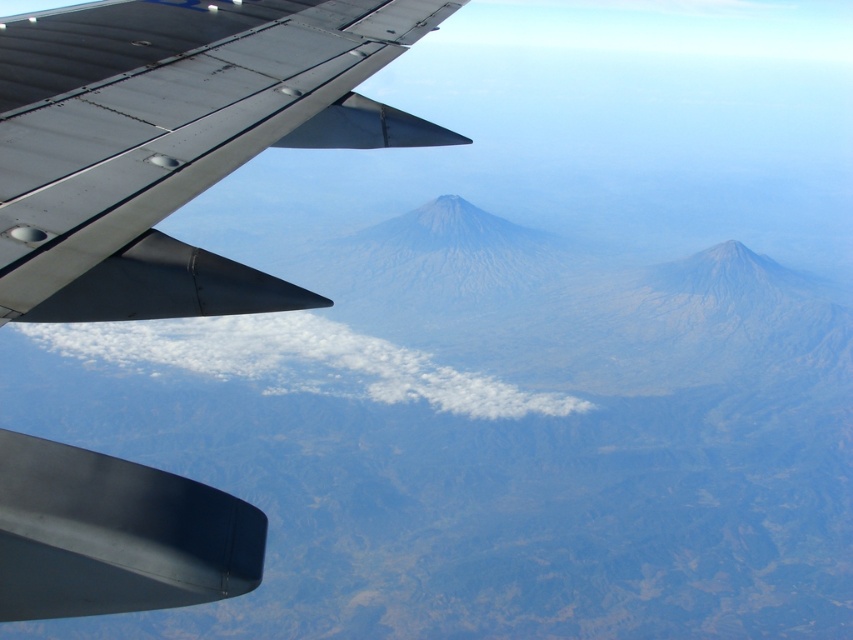
Question: Is gray/dull rock mountain range at center to the left of metallic gray wing at upper left from the viewer's perspective?

Choices:
 (A) no
 (B) yes

Answer: (B)

Question: Can you confirm if gray/dull rock mountain range at center is bigger than metallic gray wing at upper left?

Choices:
 (A) no
 (B) yes

Answer: (B)

Question: Is gray/dull rock mountain range at center smaller than metallic gray wing at upper left?

Choices:
 (A) no
 (B) yes

Answer: (A)

Question: Which point appears closest to the camera in this image?

Choices:
 (A) (115, 140)
 (B) (457, 410)

Answer: (A)